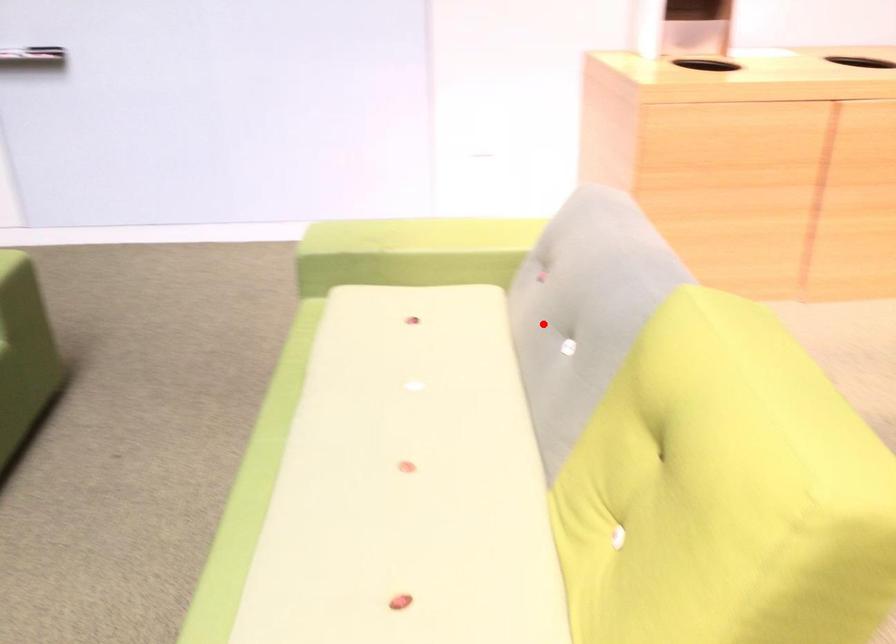
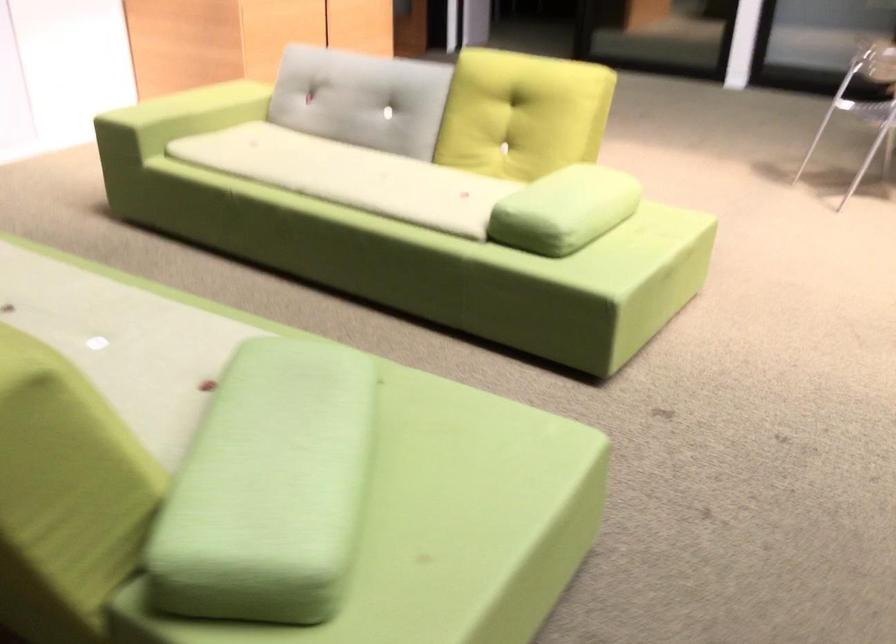
Question: I am providing you with two images of the same scene from different viewpoints. In image1, a red point is highlighted. Considering the same 3D point in image2, which of the following is correct?

Choices:
 (A) It is closer
 (B) It is farther

Answer: (B)